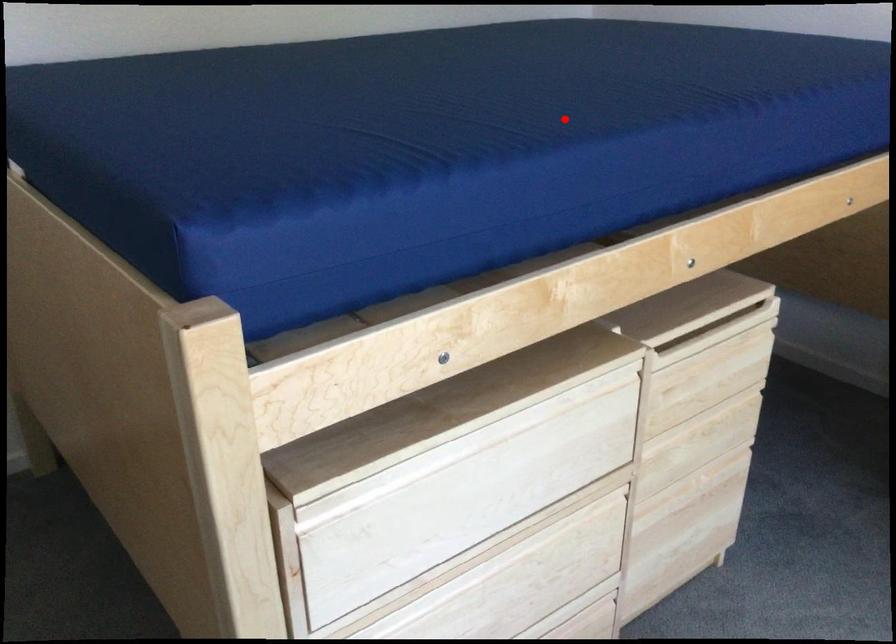
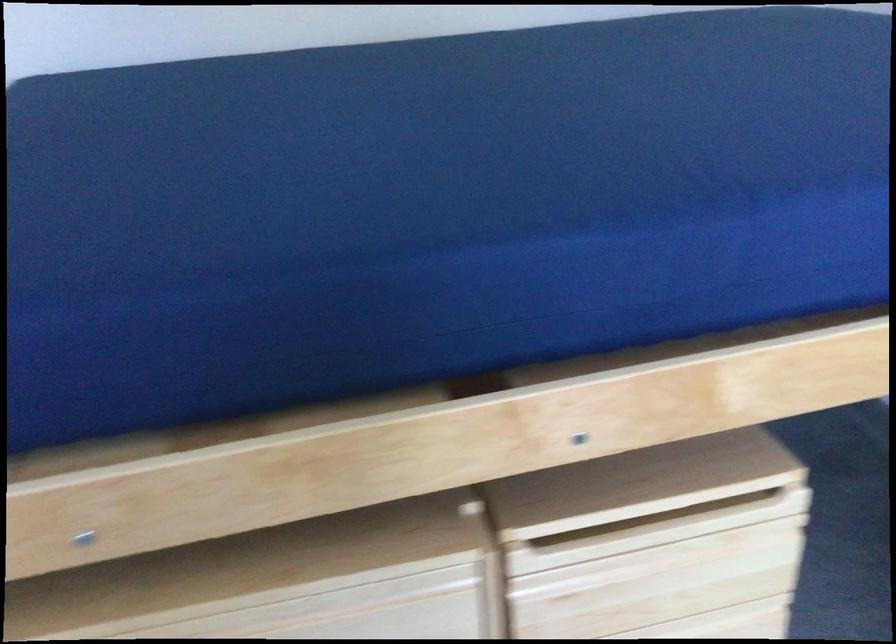
Question: I am providing you with two images of the same scene from different viewpoints. Given a red point in image1, look at the same physical point in image2. Is it:

Choices:
 (A) Closer to the viewpoint
 (B) Farther from the viewpoint

Answer: (A)